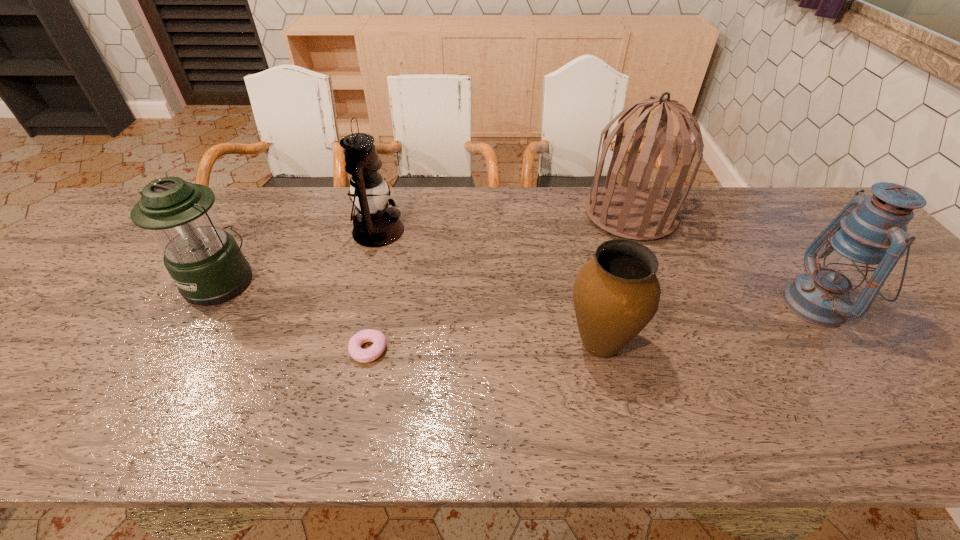
Identify the location of object that ranks as the third closest to the doughnut. This screenshot has width=960, height=540. tap(616, 294).

Identify which lantern is the closest to the leftmost lantern. Please provide its 2D coordinates. Your answer should be formatted as a tuple, i.e. [(x, y)], where the tuple contains the x and y coordinates of a point satisfying the conditions above.

[(375, 225)]

Locate which lantern is the second closest to the second lantern from right to left. Please provide its 2D coordinates. Your answer should be formatted as a tuple, i.e. [(x, y)], where the tuple contains the x and y coordinates of a point satisfying the conditions above.

[(868, 236)]

You are a GUI agent. You are given a task and a screenshot of the screen. Output one action in this format:
    pyautogui.click(x=<x>, y=<y>)
    Task: Click on the free space that satisfies the following two spatial constraints: 1. on the side of the farthest lantern, there is a wick adjustment knob; 2. on the right side of the urn
    
    Given the screenshot: What is the action you would take?
    pyautogui.click(x=349, y=345)